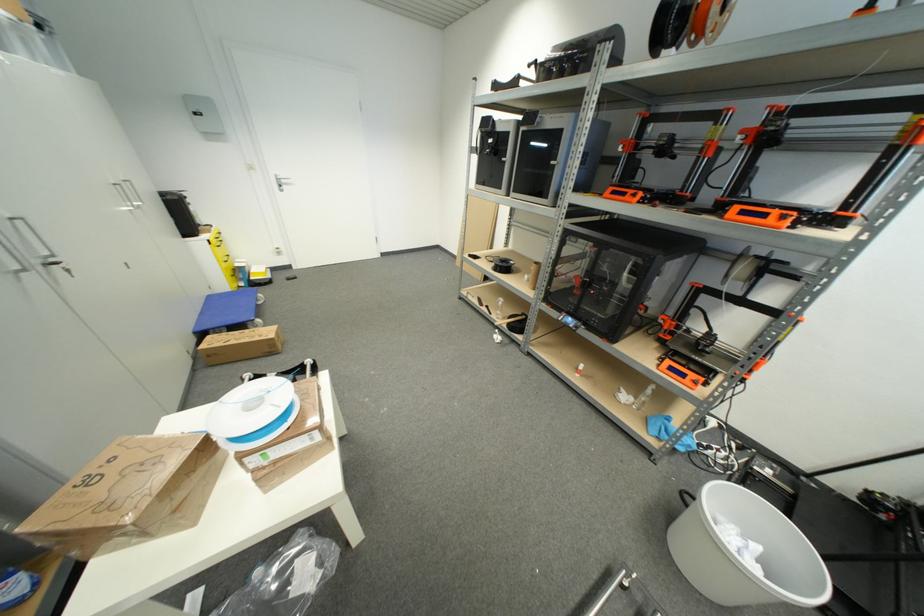
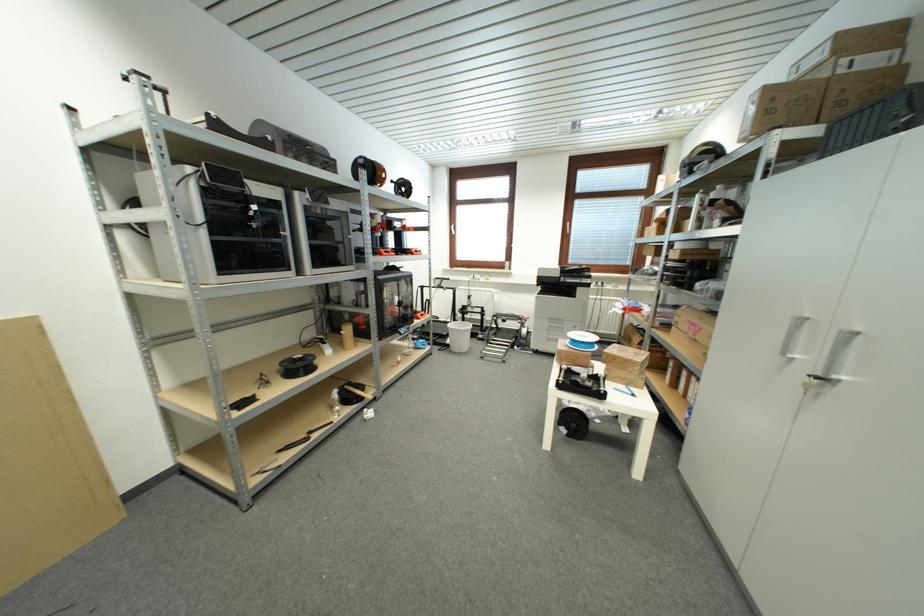
Find the pixel in the second image that matches point (769, 217) in the first image.

(422, 254)